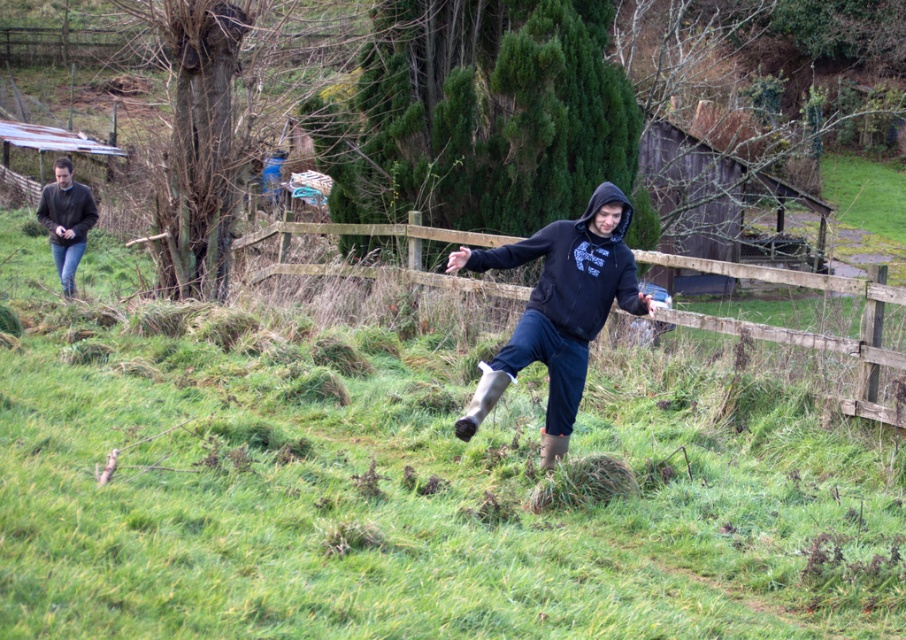
Does green grassy at center appear over dark gray hoodie at left?

Incorrect, green grassy at center is not positioned above dark gray hoodie at left.

Who is higher up, green grassy at center or dark gray hoodie at left?

dark gray hoodie at left is above.

Between point (769, 611) and point (76, 230), which one is positioned behind?

The point (76, 230) is behind.

Identify the location of green grassy at center. (408, 486).

Can you confirm if green grassy at center is positioned to the right of black hoodie at center?

No, green grassy at center is not to the right of black hoodie at center.

Where is `green grassy at center`? green grassy at center is located at coordinates (408, 486).

Measure the distance between point (137, 560) and camera.

A distance of 12.98 feet exists between point (137, 560) and camera.

Where is `green grassy at center`? The image size is (906, 640). green grassy at center is located at coordinates (408, 486).

Which is above, green grassy at center or black matte hoodie at center?

black matte hoodie at center is above.

What do you see at coordinates (408, 486) in the screenshot? Image resolution: width=906 pixels, height=640 pixels. I see `green grassy at center` at bounding box center [408, 486].

Is point (167, 628) positioned after point (619, 241)?

That is False.

Identify the location of green grassy at center. (408, 486).